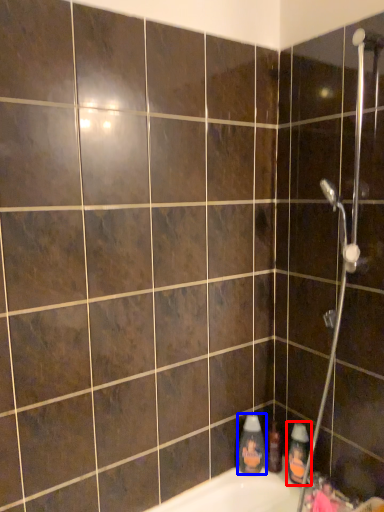
Question: Which object appears closest to the camera in this image, cleaning product (highlighted by a red box) or cleaning product (highlighted by a blue box)?

Choices:
 (A) cleaning product
 (B) cleaning product

Answer: (A)